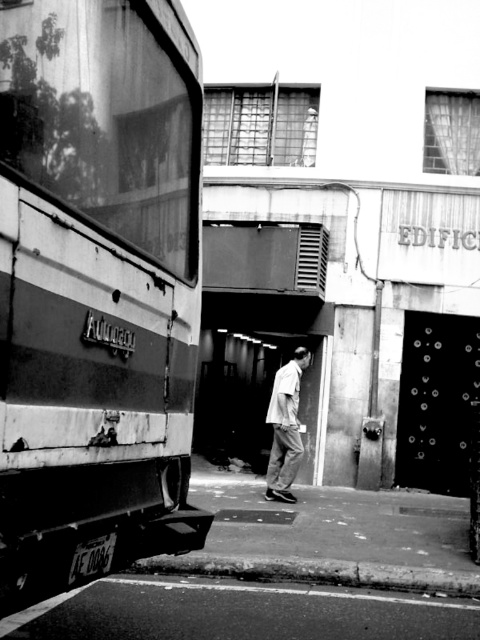
The width and height of the screenshot is (480, 640). What do you see at coordinates (96, 288) in the screenshot? I see `rusty metal train car at left` at bounding box center [96, 288].

I want to click on rusty metal train car at left, so click(96, 288).

Between rusty metal train car at left and light gray cotton shirt at center, which one is positioned lower?

light gray cotton shirt at center is below.

Between point (146, 154) and point (272, 470), which one is positioned in front?

Point (146, 154) is more forward.

Where is `rusty metal train car at left`? This screenshot has width=480, height=640. rusty metal train car at left is located at coordinates (96, 288).

Is smooth asphalt train track at lower left positioned in front of light gray cotton shirt at center?

That is True.

Which is behind, point (74, 598) or point (310, 353)?

Positioned behind is point (310, 353).

Is point (454, 598) in front of point (267, 492)?

Yes, it is.

Locate an element on the screen. smooth asphalt train track at lower left is located at coordinates (243, 611).